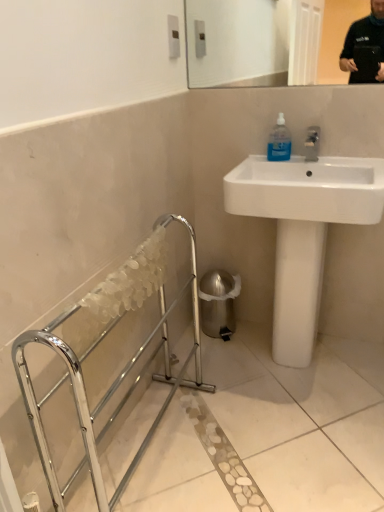
Question: Is transparent plastic bottle at upper right wider than white glossy sink at upper right?

Choices:
 (A) yes
 (B) no

Answer: (B)

Question: Does transparent plastic bottle at upper right have a greater height compared to white glossy sink at upper right?

Choices:
 (A) no
 (B) yes

Answer: (A)

Question: Is transparent plastic bottle at upper right further to camera compared to white glossy sink at upper right?

Choices:
 (A) no
 (B) yes

Answer: (B)

Question: Does transparent plastic bottle at upper right come in front of white glossy sink at upper right?

Choices:
 (A) no
 (B) yes

Answer: (A)

Question: Does transparent plastic bottle at upper right have a larger size compared to white glossy sink at upper right?

Choices:
 (A) no
 (B) yes

Answer: (A)

Question: Is transparent plastic bottle at upper right outside of white glossy sink at upper right?

Choices:
 (A) no
 (B) yes

Answer: (A)

Question: Can you confirm if chrome metallic balustrade at lower left is bigger than transparent plastic bottle at upper right?

Choices:
 (A) yes
 (B) no

Answer: (A)

Question: Is chrome metallic balustrade at lower left aimed at transparent plastic bottle at upper right?

Choices:
 (A) yes
 (B) no

Answer: (B)

Question: Does chrome metallic balustrade at lower left appear on the right side of transparent plastic bottle at upper right?

Choices:
 (A) no
 (B) yes

Answer: (A)

Question: Is chrome metallic balustrade at lower left to the left of transparent plastic bottle at upper right from the viewer's perspective?

Choices:
 (A) yes
 (B) no

Answer: (A)

Question: Is chrome metallic balustrade at lower left next to transparent plastic bottle at upper right and touching it?

Choices:
 (A) yes
 (B) no

Answer: (B)

Question: Would you say chrome metallic balustrade at lower left is a long distance from transparent plastic bottle at upper right?

Choices:
 (A) yes
 (B) no

Answer: (B)

Question: Does white glossy sink at upper right have a greater height compared to chrome metallic balustrade at lower left?

Choices:
 (A) yes
 (B) no

Answer: (A)